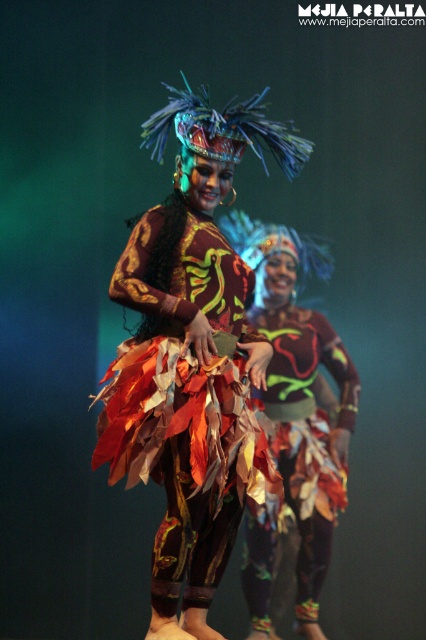
You are a photographer positioned at the back of the stage. You want to capture a clear photo of the metallic leaf skirt at center and the leaves fabric skirt at center. Which skirt will appear more prominent in your photo?

The metallic leaf skirt at center will appear more prominent in the photo because it is positioned in front of the leaves fabric skirt at center, making it closer to the camera.

You are a photographer taking a picture of the stage performance. You notice two points marked as point 1 and point 2 on your camera screen. Point 1 is at coordinates point (181, 360) and point 2 is at coordinates point (291, 352). Which point is closer to the camera?

Point (181, 360) is closer to the camera than point (291, 352).